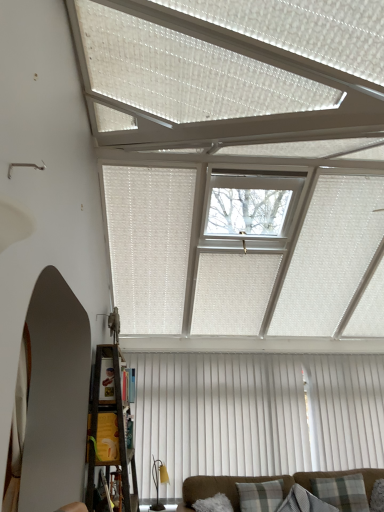
Question: Does clear glass window at center have a lesser height compared to white vertical blinds at center?

Choices:
 (A) no
 (B) yes

Answer: (B)

Question: Is clear glass window at center placed right next to white vertical blinds at center?

Choices:
 (A) no
 (B) yes

Answer: (A)

Question: Considering the relative sizes of clear glass window at center and white vertical blinds at center in the image provided, is clear glass window at center bigger than white vertical blinds at center?

Choices:
 (A) no
 (B) yes

Answer: (B)

Question: Is clear glass window at center located outside white vertical blinds at center?

Choices:
 (A) no
 (B) yes

Answer: (B)

Question: From the image's perspective, would you say clear glass window at center is positioned over white vertical blinds at center?

Choices:
 (A) yes
 (B) no

Answer: (A)

Question: In the image, is plaid fabric pillow at lower center, which appears as the 1th pillow when viewed from the left, on the left side or the right side of clear glass window at center?

Choices:
 (A) right
 (B) left

Answer: (A)

Question: Is plaid fabric pillow at lower center, which appears as the 1th pillow when viewed from the left, inside or outside of clear glass window at center?

Choices:
 (A) outside
 (B) inside

Answer: (A)

Question: Does point (279, 493) appear closer or farther from the camera than point (289, 209)?

Choices:
 (A) farther
 (B) closer

Answer: (A)

Question: Looking at their shapes, would you say plaid fabric pillow at lower center, the 3th pillow when ordered from right to left, is wider or thinner than clear glass window at center?

Choices:
 (A) wide
 (B) thin

Answer: (B)

Question: Is plaid fabric pillow at lower center, which appears as the 1th pillow when viewed from the left, in front of or behind white vertical blinds at center in the image?

Choices:
 (A) front
 (B) behind

Answer: (A)

Question: Does point (258, 498) appear closer or farther from the camera than point (269, 452)?

Choices:
 (A) closer
 (B) farther

Answer: (A)

Question: In terms of size, does plaid fabric pillow at lower center, which appears as the 1th pillow when viewed from the left, appear bigger or smaller than white vertical blinds at center?

Choices:
 (A) big
 (B) small

Answer: (B)

Question: Is plaid fabric pillow at lower center, the 3th pillow when ordered from right to left, inside or outside of white vertical blinds at center?

Choices:
 (A) outside
 (B) inside

Answer: (A)

Question: Is plaid fabric pillow at lower right, the 1th pillow viewed from the right, bigger or smaller than clear glass window at center?

Choices:
 (A) small
 (B) big

Answer: (A)

Question: From a real-world perspective, relative to clear glass window at center, is plaid fabric pillow at lower right, which is the 3th pillow in left-to-right order, vertically above or below?

Choices:
 (A) below
 (B) above

Answer: (A)